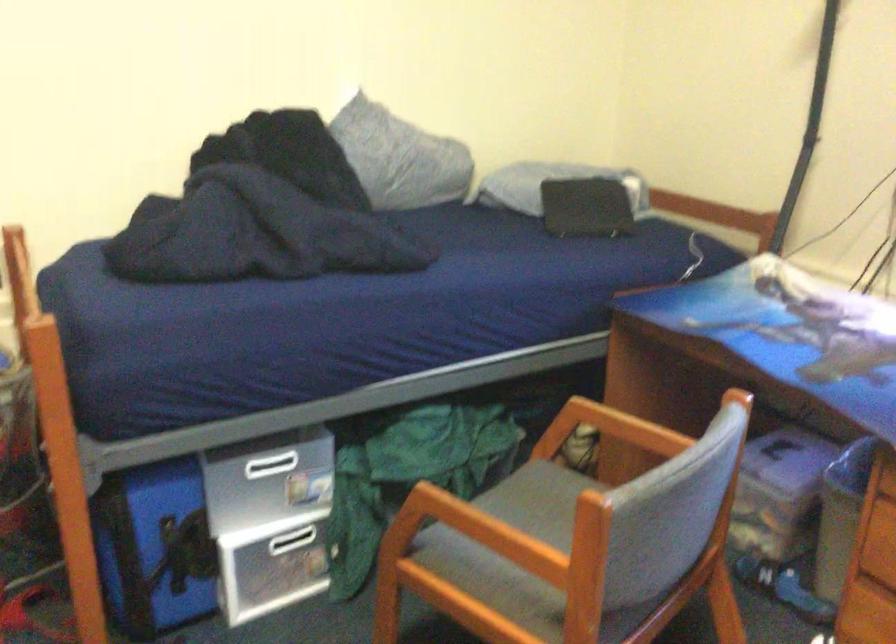
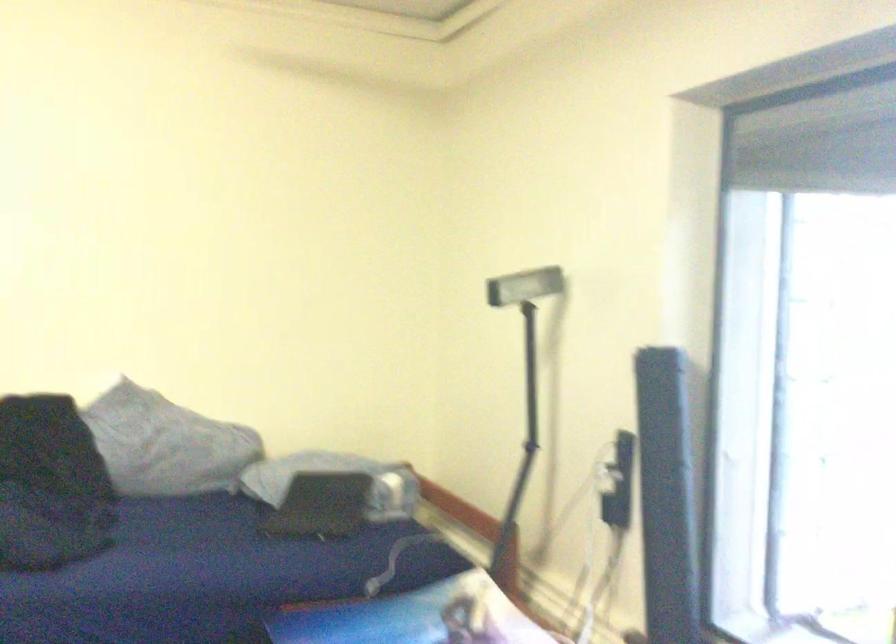
Question: What movement of the cameraman would produce the second image?

Choices:
 (A) Left
 (B) Right
 (C) Forward
 (D) Backward

Answer: (B)